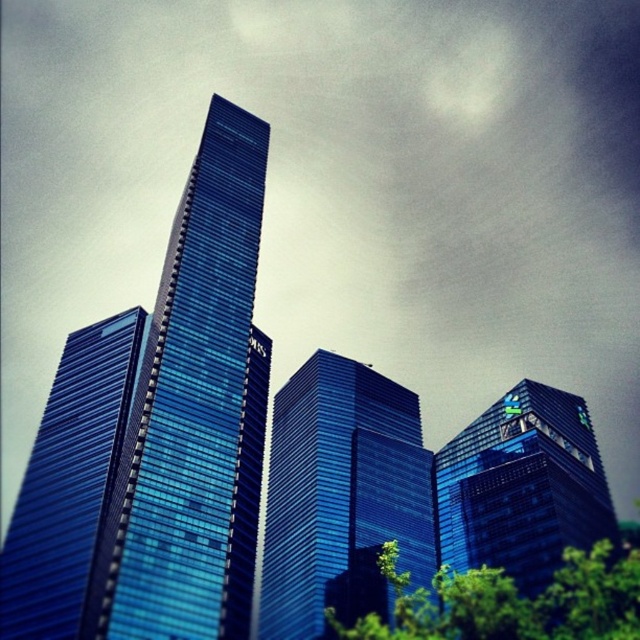
You are an architect evaluating the skyline of a city. You notice two key buildings in the scene, the blue glass skyscraper at center and the glossy glass building at upper right. Which of these two buildings appears bigger in the image?

The blue glass skyscraper at center appears bigger in the image compared to the glossy glass building at upper right as it has a larger size according to the description.

You are an architect analyzing the layout of the skyscrapers. Which of the two buildings, the blue glass skyscraper at center or the glossy glass building at upper right, appears closer to the viewer?

The blue glass skyscraper at center appears closer to the viewer because it is positioned over the glossy glass building at upper right, indicating it is in front.

You are standing in front of the cluster of modern skyscrapers and want to take a photo of the blue glass building at center and the glossy glass building at upper right. Which building should you focus on first to ensure both are in clear view?

You should focus on the blue glass building at center first because it is closer to the viewer than the glossy glass building at upper right, so adjusting focus from near to far will help capture both clearly.